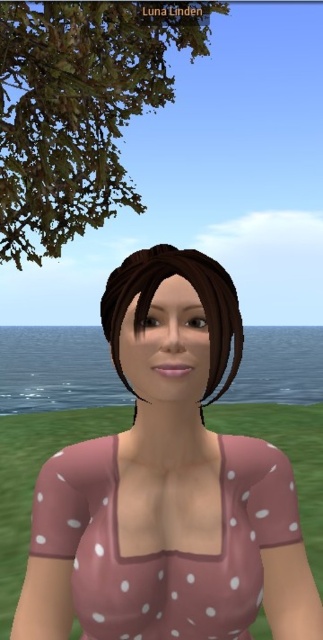
You are a fashion designer who wants to ensure the pink polka dot fabric at center and brown matte hair at center in the design don

The pink polka dot fabric at center is 23.91 centimeters from brown matte hair at center, so there is sufficient space between them to avoid any overlap or collision in the design.

You are a photographer trying to capture the character in the scene. Since the pink polka dot dress at center and the brown matte hair at center are both at the center, which one will be more visible in your photo?

The pink polka dot dress at center is in front of brown matte hair at center, so the dress will be more visible in the photo.